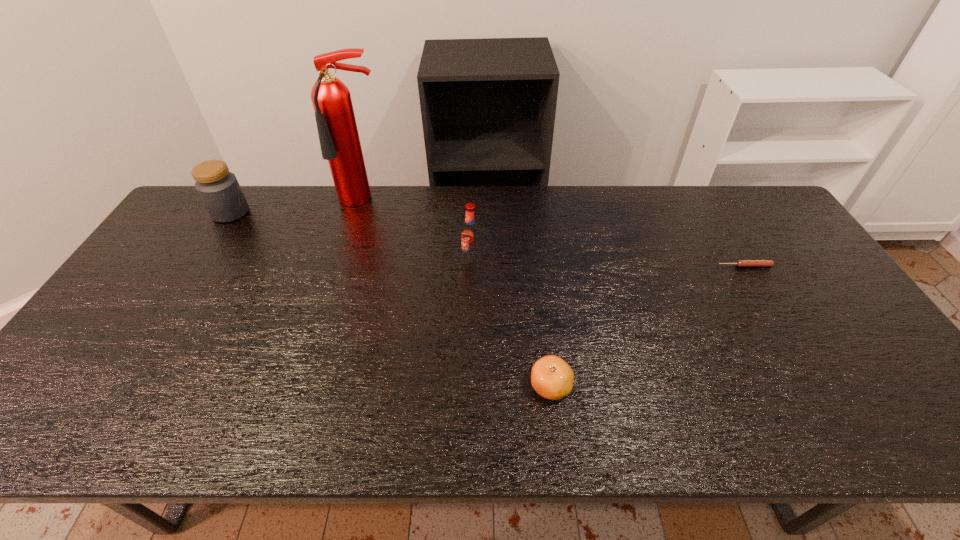
Locate an element on the screen. The width and height of the screenshot is (960, 540). the tallest object is located at coordinates (339, 139).

Locate an element on the screen. fire extinguisher is located at coordinates (339, 139).

At what (x,y) coordinates should I click in order to perform the action: click on the third object from left to right. Please return your answer as a coordinate pair (x, y). Image resolution: width=960 pixels, height=540 pixels. Looking at the image, I should click on (471, 238).

Locate an element on the screen. The image size is (960, 540). the leftmost object is located at coordinates coord(219,190).

Locate an element on the screen. This screenshot has height=540, width=960. the nearest object is located at coordinates (552, 378).

This screenshot has height=540, width=960. I want to click on the fourth tallest object, so click(552, 378).

Where is `the shortest object`? This screenshot has height=540, width=960. the shortest object is located at coordinates (740, 263).

Find the location of a particular element. Image resolution: width=960 pixels, height=540 pixels. the rightmost object is located at coordinates (740, 263).

Where is `vacant space located 0.170m at the nozzle of the tallest object`? The image size is (960, 540). vacant space located 0.170m at the nozzle of the tallest object is located at coordinates (349, 249).

Where is `vacant space located 0.100m on the back of the root beer`? vacant space located 0.100m on the back of the root beer is located at coordinates (472, 232).